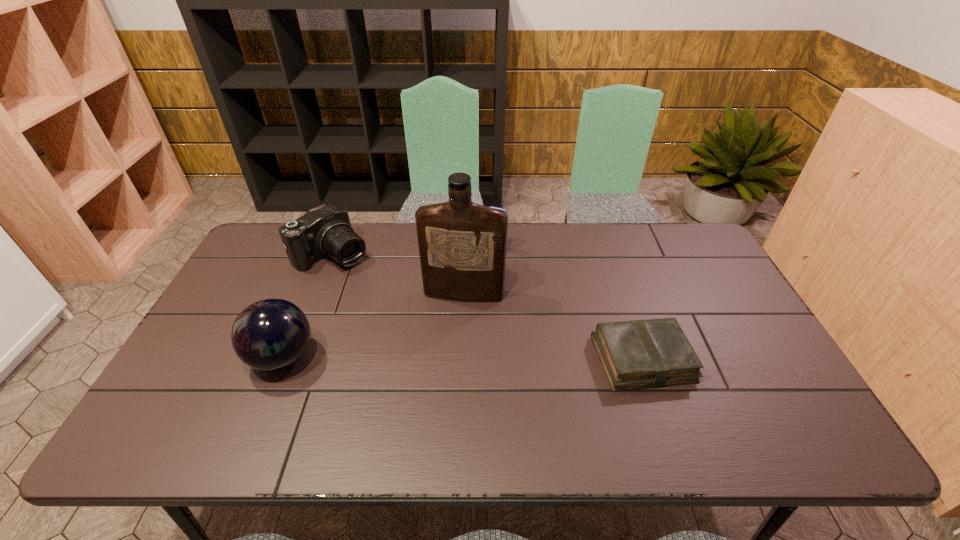
Find the location of a particular element. bowling ball is located at coordinates (271, 334).

The width and height of the screenshot is (960, 540). What are the coordinates of `the rightmost object` in the screenshot? It's located at (638, 354).

Where is `book`? book is located at coordinates (638, 354).

Image resolution: width=960 pixels, height=540 pixels. I want to click on cellular telephone, so click(499, 208).

Identify the location of the third farthest object. This screenshot has width=960, height=540. (462, 245).

The image size is (960, 540). Identify the location of the tallest object. (462, 245).

Identify the location of camera. (325, 230).

Locate an element on the screen. free space located 0.080m on the side of the bowling ball with the finger holes is located at coordinates (218, 357).

This screenshot has height=540, width=960. Identify the location of vacant region located 0.120m on the side of the bowling ball with the finger holes. (203, 357).

At what (x,y) coordinates should I click in order to perform the action: click on free space located on the back of the book. Please return your answer as a coordinate pair (x, y). Image resolution: width=960 pixels, height=540 pixels. Looking at the image, I should click on (613, 272).